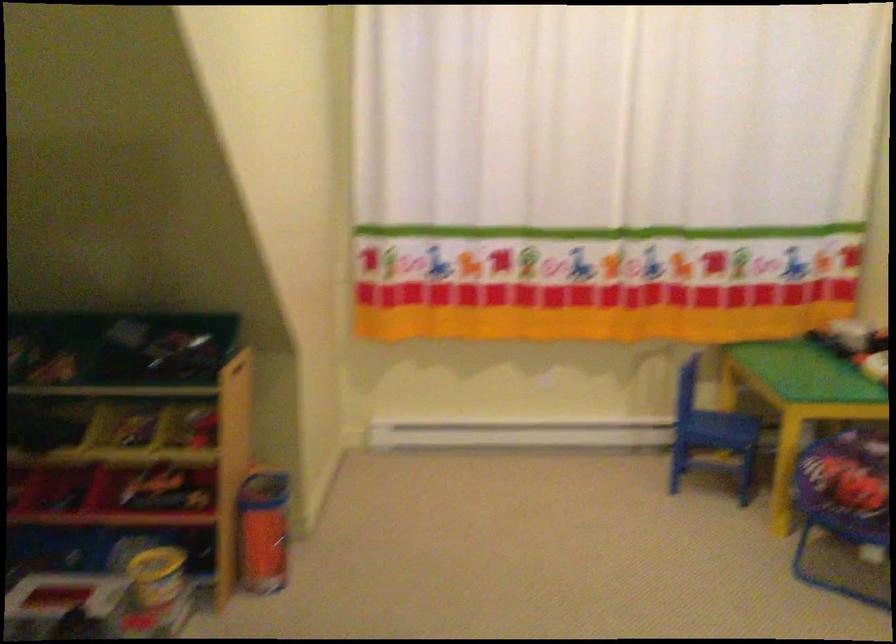
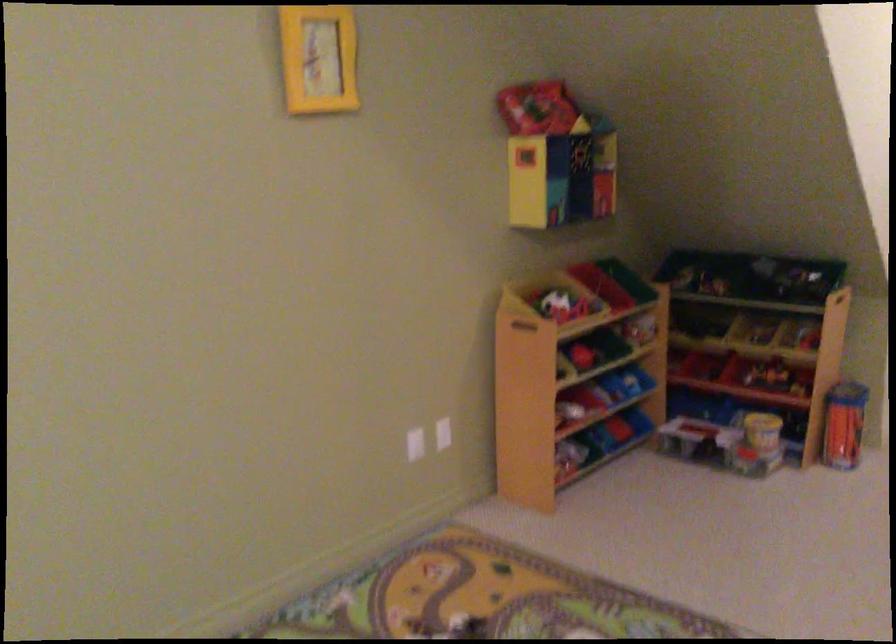
Locate, in the second image, the point that corresponds to pixel 229 386 in the first image.

(839, 303)